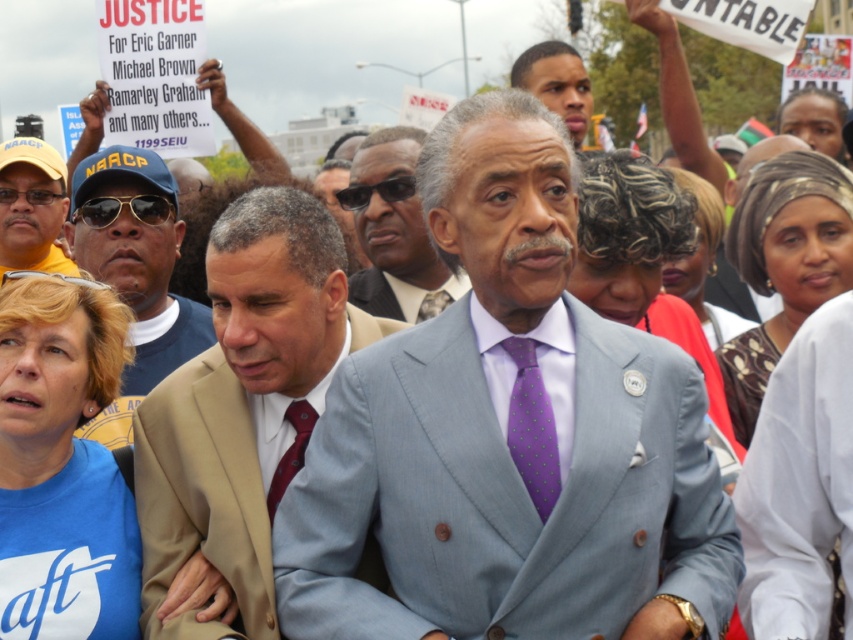
Based on the scene described, which object is taller between the light blue suit at center and the maroon silk tie at center?

The light blue suit at center is taller than the maroon silk tie at center.

You are a photographer trying to capture the main speaker at a protest. You notice two key elements in your frame, the light gray suit at center and the matte black face at upper center. Which element should you focus on to ensure the subject with the larger presence in the image is properly highlighted?

The matte black face at upper center occupies more space in the image than the light gray suit at center, so focusing on the matte black face at upper center would better highlight the subject with the larger presence.